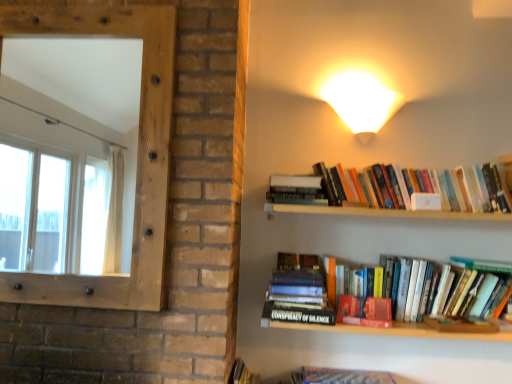
In order to click on matte red paperback book at center in this screenshot , I will do `click(364, 311)`.

This screenshot has width=512, height=384. I want to click on white glossy wall sconce at upper right, so click(x=360, y=101).

The width and height of the screenshot is (512, 384). In order to click on matte red paperback book at center in this screenshot , I will do `click(364, 311)`.

Considering the sizes of matte red paperback book at center and natural wood frame at left in the image, is matte red paperback book at center wider or thinner than natural wood frame at left?

Clearly, matte red paperback book at center has more width compared to natural wood frame at left.

From the image's perspective, between matte red paperback book at center and natural wood frame at left, who is located below?

matte red paperback book at center, from the image's perspective.

In the image, there is a natural wood frame at left. Identify the location of paperback book below it (from a real-world perspective). (364, 311).

How different are the orientations of matte red paperback book at center and natural wood frame at left in degrees?

0.513 degrees.

Identify the location of window screen in front of the hardcover books at upper right, the 2th book viewed from the left. (137, 159).

How many degrees apart are the facing directions of hardcover books at upper right, which appears as the first book when viewed from the right, and natural wood frame at left?

The angular difference between hardcover books at upper right, which appears as the first book when viewed from the right, and natural wood frame at left is 3.43 degrees.

Considering the sizes of hardcover books at upper right, which ranks as the second book in bottom-to-top order, and natural wood frame at left in the image, is hardcover books at upper right, which ranks as the second book in bottom-to-top order, taller or shorter than natural wood frame at left?

Considering their sizes, hardcover books at upper right, which ranks as the second book in bottom-to-top order, has less height than natural wood frame at left.

Is hardcover books at upper right, which appears as the first book when viewed from the right, oriented away from natural wood frame at left?

No, natural wood frame at left is not at the back of hardcover books at upper right, which appears as the first book when viewed from the right.

Which of these two, white glossy wall sconce at upper right or hardcover books at upper right, arranged as the 1th book when viewed from the top, is smaller?

white glossy wall sconce at upper right is smaller.

Considering the sizes of objects white glossy wall sconce at upper right and hardcover books at upper right, which ranks as the second book in bottom-to-top order, in the image provided, who is thinner, white glossy wall sconce at upper right or hardcover books at upper right, which ranks as the second book in bottom-to-top order,?

hardcover books at upper right, which ranks as the second book in bottom-to-top order.

Is white glossy wall sconce at upper right positioned in front of hardcover books at upper right, the 2th book viewed from the left?

No, the depth of white glossy wall sconce at upper right is greater than that of hardcover books at upper right, the 2th book viewed from the left.

From a real-world perspective, between white glossy wall sconce at upper right and hardcover books at upper right, arranged as the 1th book when viewed from the top, who is vertically lower?

From a 3D spatial view, hardcover books at upper right, arranged as the 1th book when viewed from the top, is below.

Would you say hardcover books at upper right, the 2th book viewed from the left, is inside or outside matte red paperback book at center?

hardcover books at upper right, the 2th book viewed from the left, is spatially situated outside matte red paperback book at center.

Considering the points (467, 205) and (343, 299), which point is behind, point (467, 205) or point (343, 299)?

The point (467, 205) is farther from the camera.

Which object is further away from the camera taking this photo, hardcover books at upper right, the 2th book viewed from the left, or matte red paperback book at center?

hardcover books at upper right, the 2th book viewed from the left, is more distant.

Locate an element on the screen. The image size is (512, 384). book that is the 2nd one above the matte red paperback book at center (from a real-world perspective) is located at coordinates (403, 194).

Consider the image. From the image's perspective, relative to matte red paperback book at center, is white glossy wall sconce at upper right above or below?

white glossy wall sconce at upper right is above matte red paperback book at center.

Between white glossy wall sconce at upper right and matte red paperback book at center, which one has more height?

With more height is white glossy wall sconce at upper right.

From a real-world perspective, which is physically below, white glossy wall sconce at upper right or matte red paperback book at center?

matte red paperback book at center is physically lower.

Does white glossy wall sconce at upper right turn towards matte red paperback book at center?

No, white glossy wall sconce at upper right does not turn towards matte red paperback book at center.

Does white glossy wall sconce at upper right appear on the right side of hardcover book at center, the second book viewed from the top?

Yes.

Can you confirm if white glossy wall sconce at upper right is bigger than hardcover book at center, placed as the first book when sorted from bottom to top?

Actually, white glossy wall sconce at upper right might be smaller than hardcover book at center, placed as the first book when sorted from bottom to top.

Starting from the white glossy wall sconce at upper right, which book is the 2nd one in front? Please provide its 2D coordinates.

[(301, 291)]

From the image's perspective, which one is positioned higher, hardcover books at upper right, which appears as the first book when viewed from the right, or white glossy wall sconce at upper right?

From the image's view, white glossy wall sconce at upper right is above.

Is hardcover books at upper right, arranged as the 1th book when viewed from the top, facing towards white glossy wall sconce at upper right?

No.

Are hardcover books at upper right, which ranks as the second book in bottom-to-top order, and white glossy wall sconce at upper right located far from each other?

No, hardcover books at upper right, which ranks as the second book in bottom-to-top order, is in close proximity to white glossy wall sconce at upper right.

The image size is (512, 384). I want to click on paperback book below the natural wood frame at left (from the image's perspective), so (364, 311).

Find the location of a particular element. The height and width of the screenshot is (384, 512). book that is the 2nd object to the right of the natural wood frame at left, starting at the anchor is located at coordinates (403, 194).

From the image, which object appears to be nearer to white glossy wall sconce at upper right, matte red paperback book at center or hardcover book at center, the 1th book viewed from the left?

Among the two, hardcover book at center, the 1th book viewed from the left, is located nearer to white glossy wall sconce at upper right.

From the picture: Considering their positions, is hardcover book at center, acting as the 2th book starting from the right, positioned closer to white glossy wall sconce at upper right than matte red paperback book at center?

Based on the image, hardcover book at center, acting as the 2th book starting from the right, appears to be nearer to white glossy wall sconce at upper right.

Considering their positions, is white glossy wall sconce at upper right positioned further to hardcover book at center, placed as the first book when sorted from bottom to top, than matte red paperback book at center?

The object further to hardcover book at center, placed as the first book when sorted from bottom to top, is white glossy wall sconce at upper right.

Estimate the real-world distances between objects in this image. Which object is further from natural wood frame at left, hardcover books at upper right, which ranks as the second book in bottom-to-top order, or hardcover book at center, placed as the first book when sorted from bottom to top?

hardcover books at upper right, which ranks as the second book in bottom-to-top order, is positioned further to the anchor natural wood frame at left.

Looking at the image, which one is located further to white glossy wall sconce at upper right, natural wood frame at left or matte red paperback book at center?

The object further to white glossy wall sconce at upper right is natural wood frame at left.

Consider the image. When comparing their distances from natural wood frame at left, does hardcover books at upper right, which appears as the first book when viewed from the right, or matte red paperback book at center seem further?

matte red paperback book at center is positioned further to the anchor natural wood frame at left.

Considering their positions, is hardcover books at upper right, the 2th book viewed from the left, positioned further to white glossy wall sconce at upper right than natural wood frame at left?

natural wood frame at left is further to white glossy wall sconce at upper right.

Which object lies further to the anchor point hardcover books at upper right, which ranks as the second book in bottom-to-top order, hardcover book at center, the second book viewed from the top, or natural wood frame at left?

Among the two, natural wood frame at left is located further to hardcover books at upper right, which ranks as the second book in bottom-to-top order.

Locate an element on the screen. book between white glossy wall sconce at upper right and hardcover book at center, placed as the first book when sorted from bottom to top, in the vertical direction is located at coordinates (403, 194).

The width and height of the screenshot is (512, 384). I want to click on light situated between natural wood frame at left and hardcover books at upper right, the 2th book viewed from the left, from left to right, so click(x=360, y=101).

The image size is (512, 384). I want to click on book between natural wood frame at left and hardcover books at upper right, which ranks as the second book in bottom-to-top order, so click(301, 291).

This screenshot has width=512, height=384. I want to click on book between natural wood frame at left and matte red paperback book at center from left to right, so click(301, 291).